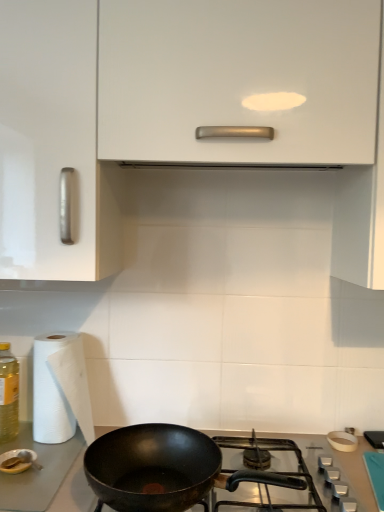
Where is `free space on the front side of white paper at left`? The height and width of the screenshot is (512, 384). free space on the front side of white paper at left is located at coordinates (42, 476).